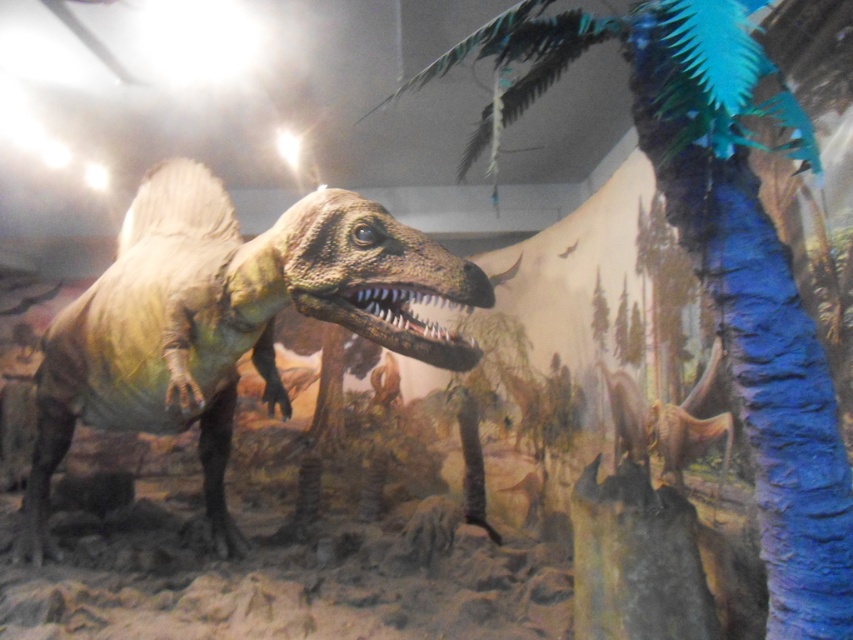
You are a visitor at the museum exhibit and see the blue feathered palm tree at center and the shiny metallic dinosaur at center. Which object is closer to the front of the scene?

The shiny metallic dinosaur at center is closer to the front because the blue feathered palm tree at center is positioned over it, indicating it is in front.

You are a museum visitor standing in front of the prehistoric exhibit. You notice the blue feathered palm tree at center and the shiny metallic dinosaur at center. Which object appears narrower in width?

The blue feathered palm tree at center has a lesser width compared to the shiny metallic dinosaur at center, so the blue feathered palm tree at center appears narrower.